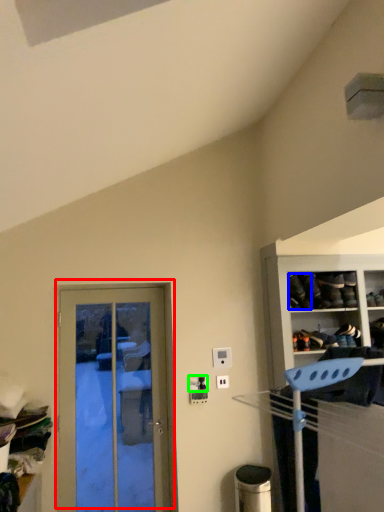
Question: Considering the real-world distances, which object is closest to door (highlighted by a red box)? shoe (highlighted by a blue box) or electric outlet (highlighted by a green box).

Choices:
 (A) shoe
 (B) electric outlet

Answer: (B)